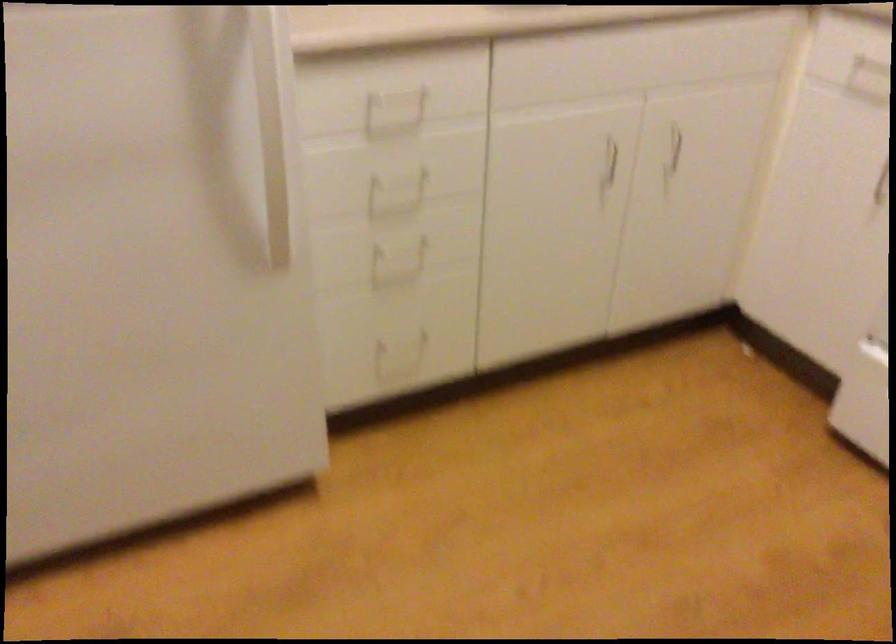
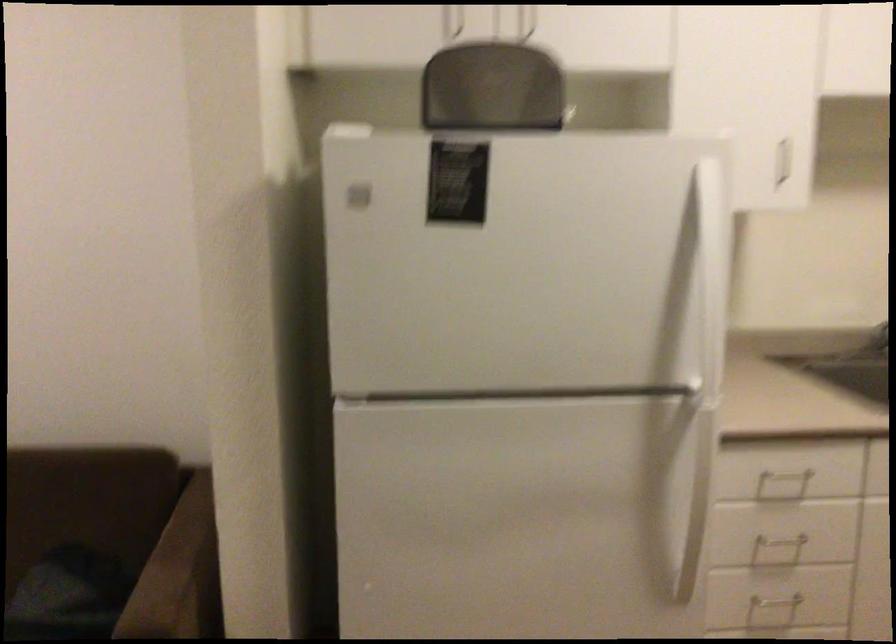
Where in the second image is the point corresponding to (394,184) from the first image?

(778, 547)